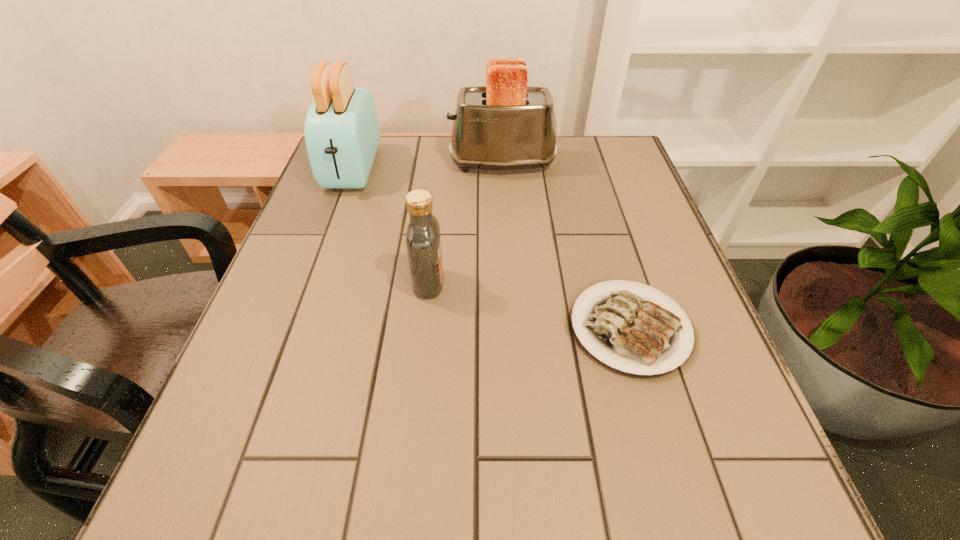
Identify the location of the leftmost object. The height and width of the screenshot is (540, 960). (342, 134).

Locate an element on the screen. The image size is (960, 540). the right toaster is located at coordinates (506, 124).

This screenshot has height=540, width=960. Identify the location of the second shortest object. (423, 237).

Find the location of a particular element. the shortest object is located at coordinates (631, 332).

Locate an element on the screen. This screenshot has height=540, width=960. vacant space situated on the side of the left toaster with the lever is located at coordinates (335, 218).

Identify the location of free space located on the side of the right toaster with the control lever. (397, 163).

The height and width of the screenshot is (540, 960). What are the coordinates of `vacant space located on the side of the right toaster with the control lever` in the screenshot? It's located at coord(405,163).

Image resolution: width=960 pixels, height=540 pixels. I want to click on vacant area situated 0.190m on the side of the right toaster with the control lever, so click(x=379, y=163).

This screenshot has width=960, height=540. What are the coordinates of `free space located on the front-facing side of the third tallest object` in the screenshot? It's located at (628, 283).

Where is `blank space located on the left of the plate`? The width and height of the screenshot is (960, 540). blank space located on the left of the plate is located at coordinates 375,328.